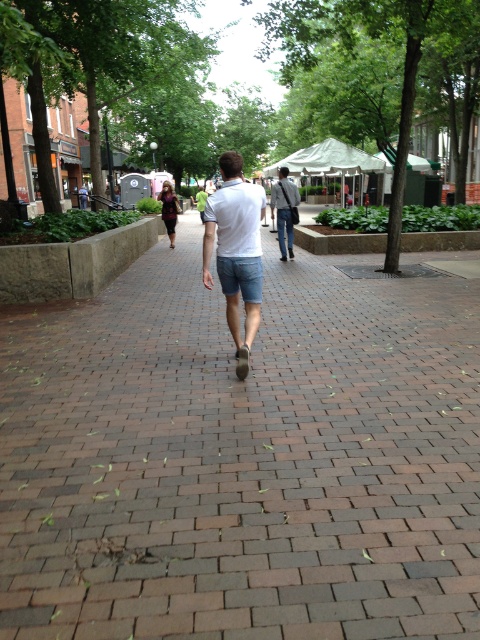
Question: Is brick pavement at center smaller than white cotton shirt at center?

Choices:
 (A) no
 (B) yes

Answer: (A)

Question: Among these objects, which one is nearest to the camera?

Choices:
 (A) light blue denim shorts at center
 (B) white cotton shirt at center

Answer: (B)

Question: Considering the relative positions of white cotton shirt at center and light blue denim shorts at center in the image provided, where is white cotton shirt at center located with respect to light blue denim shorts at center?

Choices:
 (A) left
 (B) right

Answer: (A)

Question: Is brick pavement at center smaller than white cotton shirt at center?

Choices:
 (A) no
 (B) yes

Answer: (A)

Question: Which object is the farthest from the light blue denim shorts at center?

Choices:
 (A) brick pavement at center
 (B) white cotton shirt at center

Answer: (B)

Question: Which object appears closest to the camera in this image?

Choices:
 (A) white cotton shirt at center
 (B) brick pavement at center

Answer: (B)